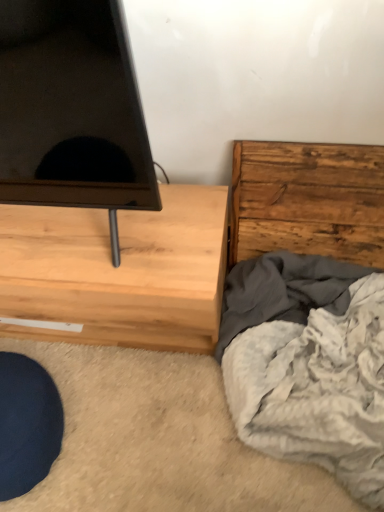
Question: From the image's perspective, would you say rustic wood chest of drawers at right, which is the 2th chest of drawers in left-to-right order, is positioned over light wood chest of drawers at left, marked as the 2th chest of drawers in a right-to-left arrangement?

Choices:
 (A) no
 (B) yes

Answer: (B)

Question: Considering the relative sizes of rustic wood chest of drawers at right, which is the 2th chest of drawers in left-to-right order, and light wood chest of drawers at left, marked as the 2th chest of drawers in a right-to-left arrangement, in the image provided, is rustic wood chest of drawers at right, which is the 2th chest of drawers in left-to-right order, shorter than light wood chest of drawers at left, marked as the 2th chest of drawers in a right-to-left arrangement,?

Choices:
 (A) no
 (B) yes

Answer: (A)

Question: Is rustic wood chest of drawers at right, which is the 2th chest of drawers in left-to-right order, looking in the opposite direction of light wood chest of drawers at left, marked as the 2th chest of drawers in a right-to-left arrangement?

Choices:
 (A) no
 (B) yes

Answer: (A)

Question: Considering the relative positions of rustic wood chest of drawers at right, the 1th chest of drawers viewed from the right, and light wood chest of drawers at left, marked as the 2th chest of drawers in a right-to-left arrangement, in the image provided, is rustic wood chest of drawers at right, the 1th chest of drawers viewed from the right, behind light wood chest of drawers at left, marked as the 2th chest of drawers in a right-to-left arrangement,?

Choices:
 (A) no
 (B) yes

Answer: (B)

Question: Is light wood chest of drawers at left, marked as the 2th chest of drawers in a right-to-left arrangement, a part of rustic wood chest of drawers at right, the 1th chest of drawers viewed from the right?

Choices:
 (A) no
 (B) yes

Answer: (A)

Question: Is rustic wood chest of drawers at right, which is the 2th chest of drawers in left-to-right order, oriented towards light wood chest of drawers at left, marked as the 2th chest of drawers in a right-to-left arrangement?

Choices:
 (A) no
 (B) yes

Answer: (A)

Question: From the image's perspective, is soft gray blanket at lower right over rustic wood chest of drawers at right, the 1th chest of drawers viewed from the right?

Choices:
 (A) no
 (B) yes

Answer: (A)

Question: Is soft gray blanket at lower right positioned far away from rustic wood chest of drawers at right, the 1th chest of drawers viewed from the right?

Choices:
 (A) no
 (B) yes

Answer: (A)

Question: Is soft gray blanket at lower right beside rustic wood chest of drawers at right, the 1th chest of drawers viewed from the right?

Choices:
 (A) no
 (B) yes

Answer: (A)

Question: From a real-world perspective, is soft gray blanket at lower right located higher than rustic wood chest of drawers at right, the 1th chest of drawers viewed from the right?

Choices:
 (A) yes
 (B) no

Answer: (B)

Question: Considering the relative positions of soft gray blanket at lower right and rustic wood chest of drawers at right, which is the 2th chest of drawers in left-to-right order, in the image provided, is soft gray blanket at lower right to the left of rustic wood chest of drawers at right, which is the 2th chest of drawers in left-to-right order, from the viewer's perspective?

Choices:
 (A) no
 (B) yes

Answer: (B)

Question: Does soft gray blanket at lower right have a greater width compared to rustic wood chest of drawers at right, the 1th chest of drawers viewed from the right?

Choices:
 (A) yes
 (B) no

Answer: (A)

Question: Does rustic wood chest of drawers at right, which is the 2th chest of drawers in left-to-right order, have a smaller size compared to soft gray blanket at lower right?

Choices:
 (A) yes
 (B) no

Answer: (A)